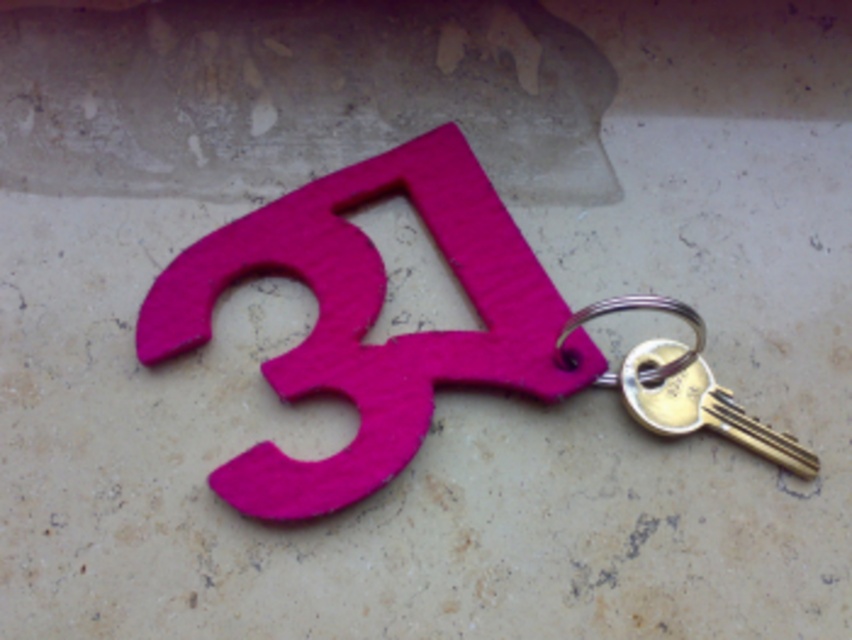
Question: From the image, what is the correct spatial relationship of matte pink keychain at center in relation to gold metallic key at center?

Choices:
 (A) left
 (B) right

Answer: (A)

Question: Does matte pink keychain at center have a lesser width compared to gold metallic key at center?

Choices:
 (A) no
 (B) yes

Answer: (A)

Question: Can you confirm if matte pink keychain at center is positioned below gold metallic key at center?

Choices:
 (A) yes
 (B) no

Answer: (B)

Question: Which object appears farthest from the camera in this image?

Choices:
 (A) gold metallic key at center
 (B) matte pink keychain at center

Answer: (B)